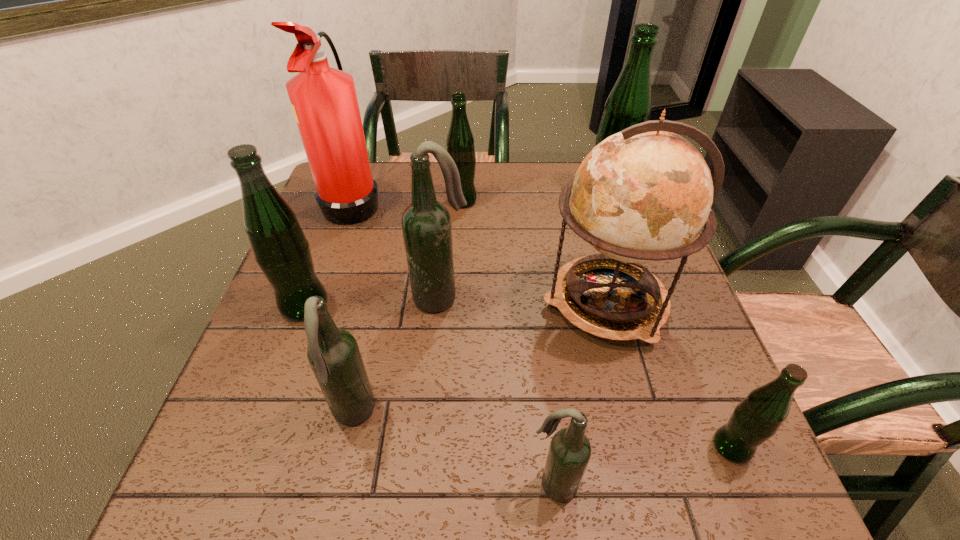
Locate an element on the screen. The width and height of the screenshot is (960, 540). fire extinguisher is located at coordinates (324, 101).

I want to click on the biggest green beer bottle, so (630, 102).

Find the location of a particular element. This screenshot has height=540, width=960. globe is located at coordinates (642, 195).

The image size is (960, 540). What are the coordinates of `the farthest dark beer bottle` in the screenshot? It's located at (x=426, y=224).

Identify the location of the second dark beer bottle from right to left. The height and width of the screenshot is (540, 960). (426, 224).

This screenshot has width=960, height=540. I want to click on the second nearest green beer bottle, so click(x=280, y=248).

The width and height of the screenshot is (960, 540). Find the location of `the leftmost green beer bottle`. the leftmost green beer bottle is located at coordinates (280, 248).

Identify the location of the sixth beer bottle from right to left. (333, 354).

In order to click on the second biggest dark beer bottle in this screenshot , I will do `click(333, 354)`.

Where is `the second smallest green beer bottle`? This screenshot has width=960, height=540. the second smallest green beer bottle is located at coordinates (460, 142).